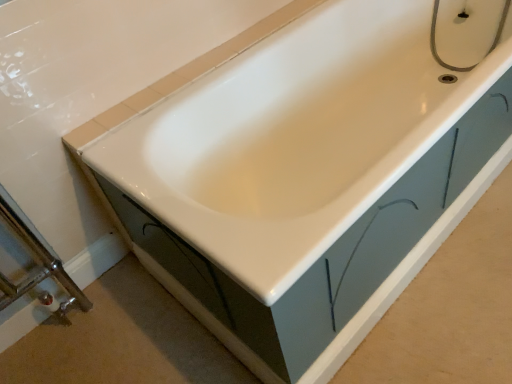
I want to click on vacant space to the right of brushed metal shower door at lower left, so click(110, 322).